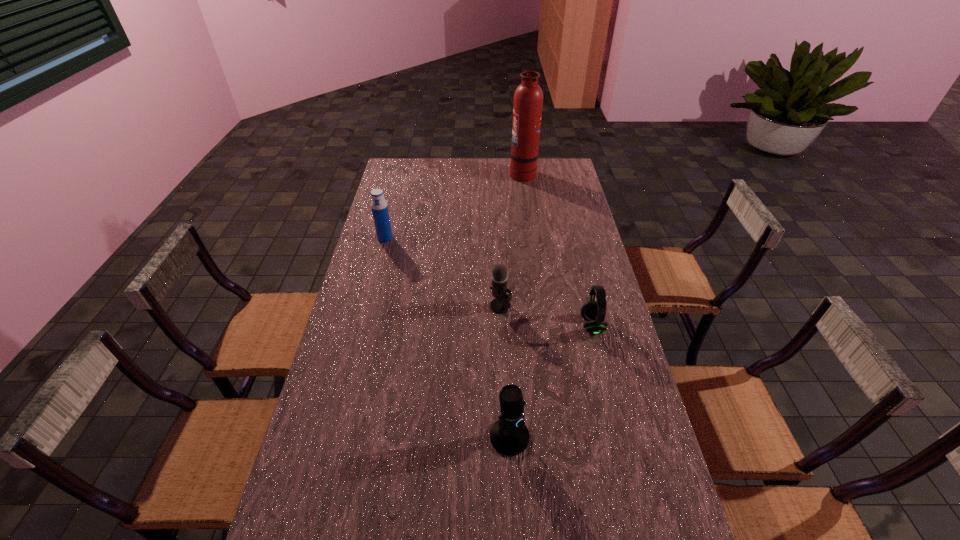
You are a GUI agent. You are given a task and a screenshot of the screen. Output one action in this format:
    pyautogui.click(x=<x>, y=<y>)
    Task: Click on the free space located 0.290m on the label side of the fourth object from left to right
    
    Given the screenshot: What is the action you would take?
    pyautogui.click(x=449, y=173)

Where is `vacant region located 0.130m on the front of the water bottle`? The height and width of the screenshot is (540, 960). vacant region located 0.130m on the front of the water bottle is located at coordinates (378, 265).

The width and height of the screenshot is (960, 540). What are the coordinates of `vacant space located on the left of the nearer microphone` in the screenshot? It's located at (467, 437).

Locate an element on the screen. Image resolution: width=960 pixels, height=540 pixels. vacant region located 0.150m on the right of the farther microphone is located at coordinates tap(556, 306).

Where is `vacant space located 0.100m on the ear cups of the rightmost object`? vacant space located 0.100m on the ear cups of the rightmost object is located at coordinates (550, 326).

Find the location of a particular element. The height and width of the screenshot is (540, 960). vacant space located on the ear cups of the rightmost object is located at coordinates (546, 326).

This screenshot has width=960, height=540. Identify the location of free space located 0.360m on the ear cups of the rightmost object. (469, 326).

What are the coordinates of `object at the far edge` in the screenshot? It's located at click(528, 99).

This screenshot has height=540, width=960. I want to click on object present at the left edge, so click(379, 206).

I want to click on object that is at the right edge, so click(x=593, y=312).